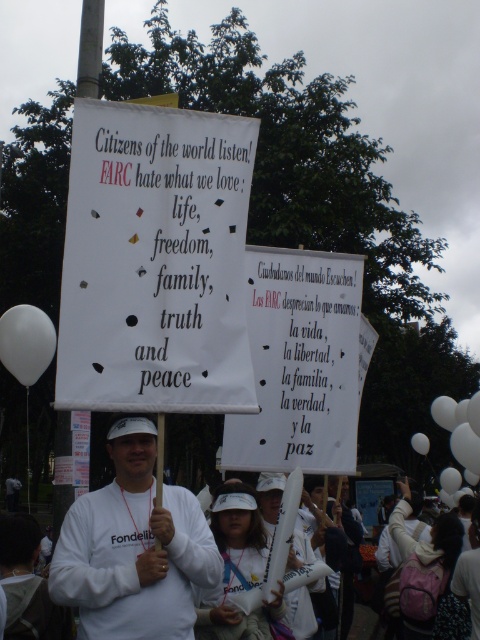
Question: In this image, where is white matte shirt at center located relative to white matte balloon at lower left?

Choices:
 (A) above
 (B) below

Answer: (B)

Question: Which object is the farthest from the white matte shirt at center?

Choices:
 (A) white paper sign at center
 (B) white matte balloon at lower left

Answer: (B)

Question: Which of the following is the farthest from the observer?

Choices:
 (A) (45, 348)
 (B) (158, 388)

Answer: (A)

Question: Observing the image, what is the correct spatial positioning of white matte shirt at center in reference to white matte balloon at lower left?

Choices:
 (A) below
 (B) above

Answer: (A)

Question: Observing the image, what is the correct spatial positioning of white paper sign at center in reference to white matte balloon at lower left?

Choices:
 (A) left
 (B) right

Answer: (B)

Question: Which point is closer to the camera?

Choices:
 (A) white balloon at center
 (B) white paper sign at center
 (C) white matte balloon at lower left

Answer: (B)